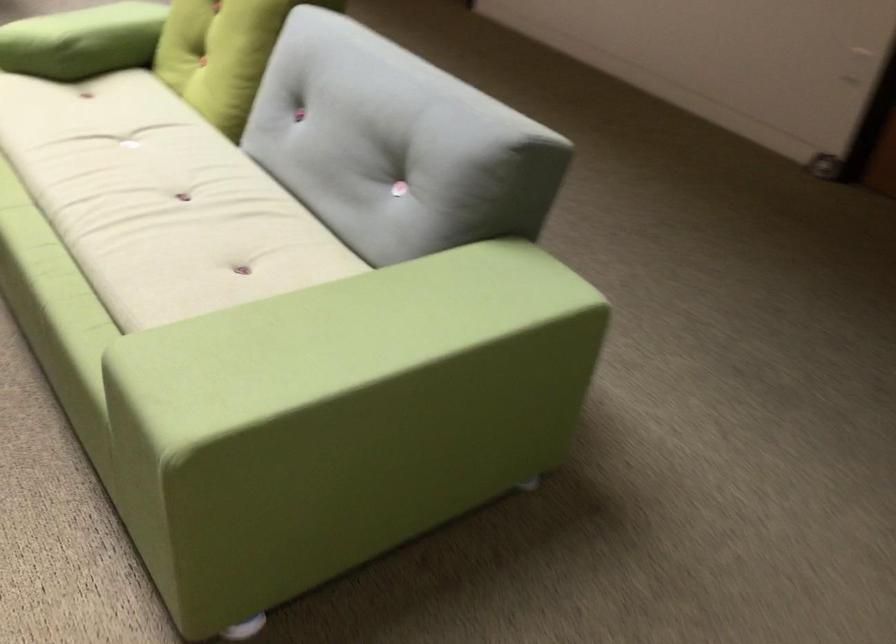
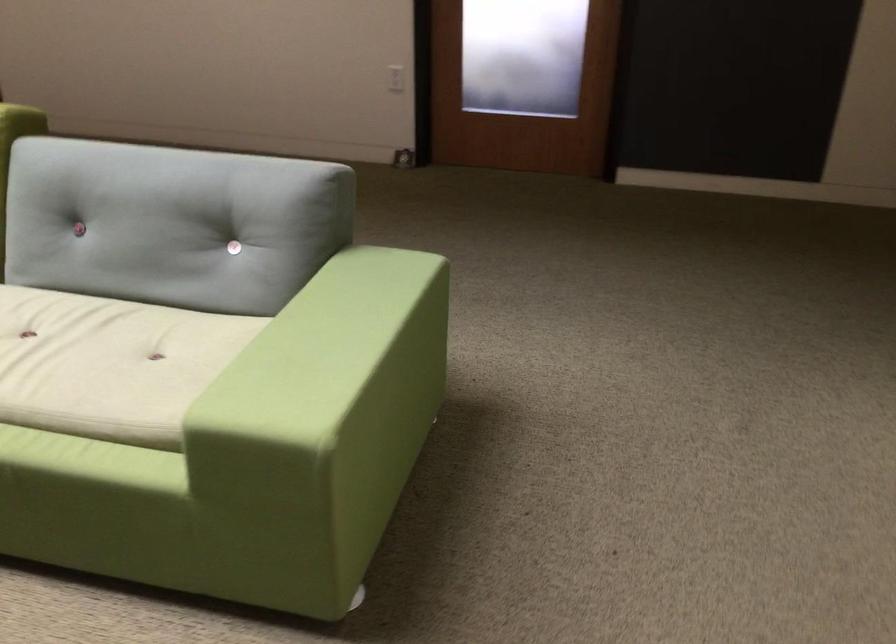
In the second image, find the point that corresponds to (196,254) in the first image.

(109, 364)